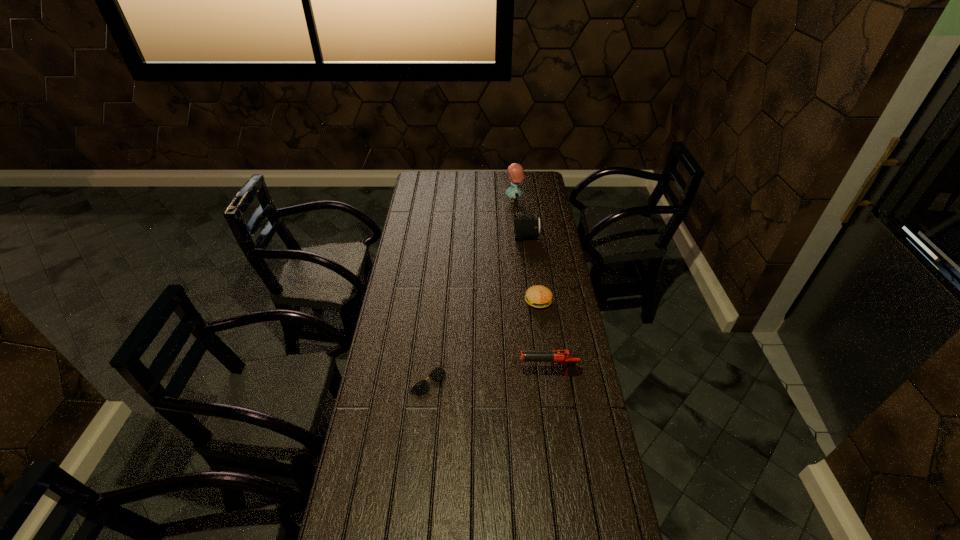
This screenshot has width=960, height=540. In order to click on vacant region that satisfies the following two spatial constraints: 1. on the back side of the second shortest object; 2. on the right side of the spectacles in this screenshot , I will do `click(436, 301)`.